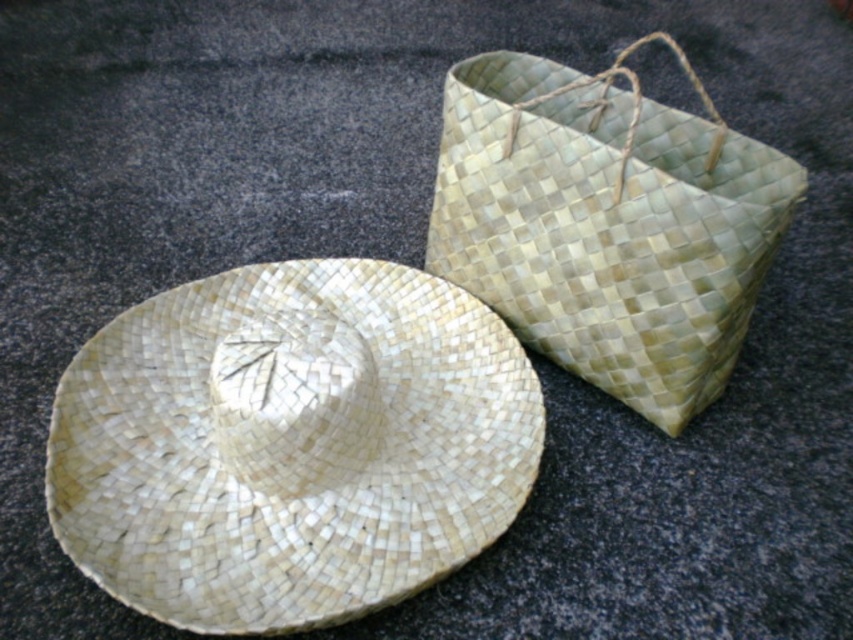
Question: Is natural woven straw hat at center above green woven basket at upper right?

Choices:
 (A) yes
 (B) no

Answer: (B)

Question: Which point is farther from the camera taking this photo?

Choices:
 (A) (671, 202)
 (B) (378, 452)

Answer: (B)

Question: Can you confirm if natural woven straw hat at center is thinner than green woven basket at upper right?

Choices:
 (A) yes
 (B) no

Answer: (B)

Question: Which of the following is the farthest from the observer?

Choices:
 (A) natural woven straw hat at center
 (B) green woven basket at upper right

Answer: (B)

Question: Is the position of natural woven straw hat at center less distant than that of green woven basket at upper right?

Choices:
 (A) yes
 (B) no

Answer: (A)